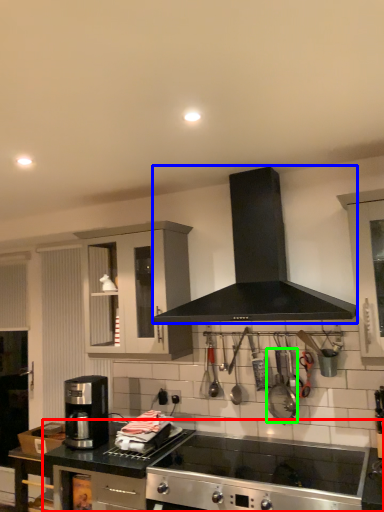
Question: Considering the real-world distances, which object is farthest from countertop (highlighted by a red box)? kitchen appliance (highlighted by a blue box) or appliance (highlighted by a green box)?

Choices:
 (A) kitchen appliance
 (B) appliance

Answer: (A)